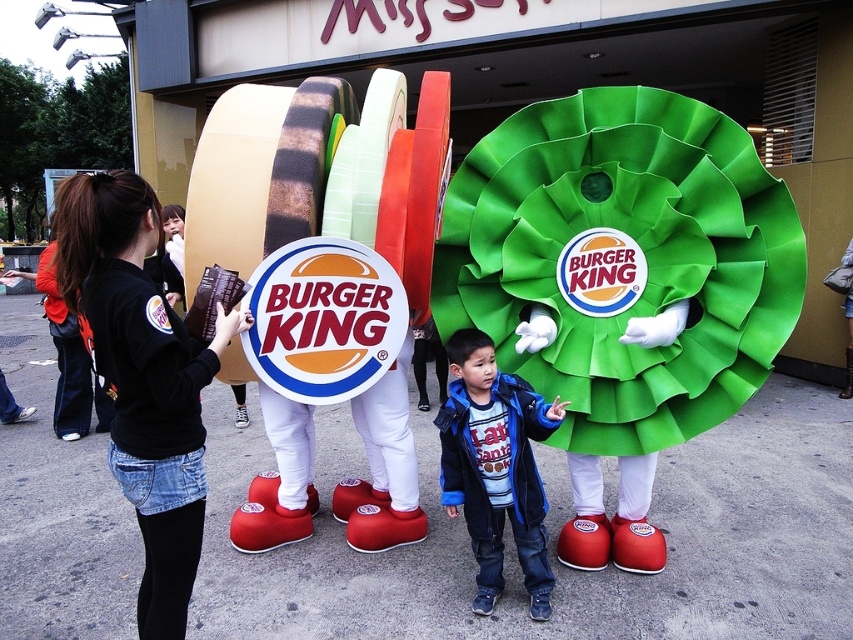
Based on the photo, you are a photographer trying to capture a group photo of the black fabric jacket at left and the blue fleece jacket at center. The camera you are using has a maximum focus range of 5 feet. Can you fit both jackets into the frame without moving the camera?

→ The distance between the black fabric jacket at left and the blue fleece jacket at center is 4.07 feet, which is within the camera maximum focus range of 5 feet. Therefore, you can fit both jackets into the frame without moving the camera.

You are a photographer trying to capture both the black fabric jacket at left and the blue fleece jacket at center in a single shot. Which jacket should you focus on first to ensure both are in frame?

The black fabric jacket at left is located above the blue fleece jacket at center, so focusing on the lower jacket first would allow you to adjust the frame to include both.